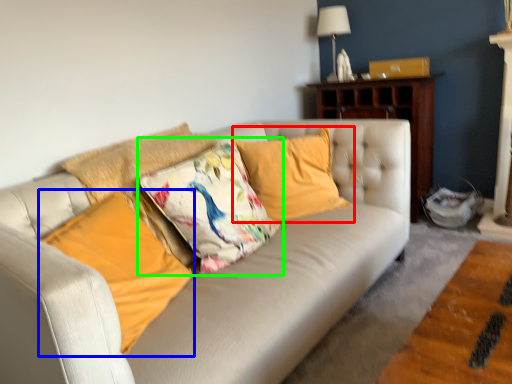
Question: Considering the real-world distances, which object is closest to pillow (highlighted by a red box)? pillow (highlighted by a blue box) or pillow (highlighted by a green box).

Choices:
 (A) pillow
 (B) pillow

Answer: (B)